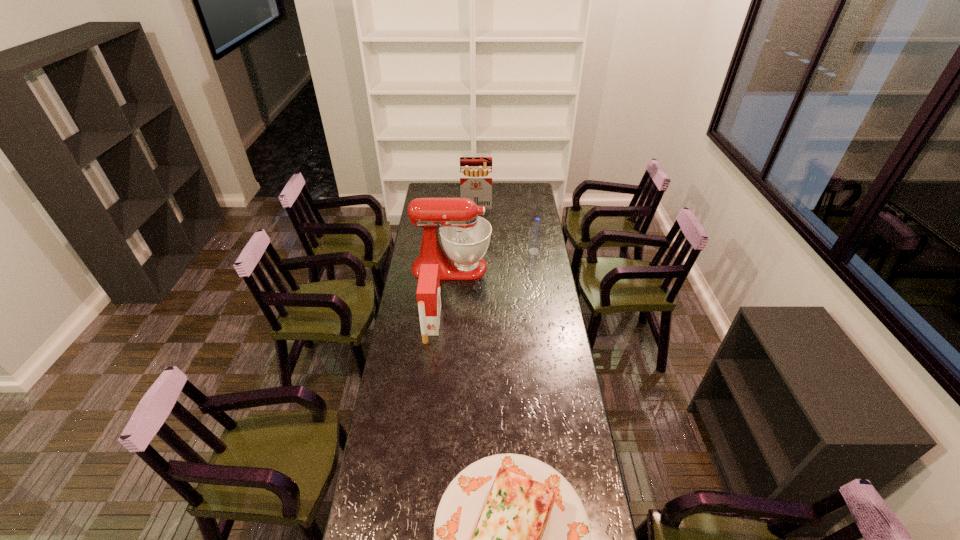
This screenshot has height=540, width=960. I want to click on mixer that is at the left edge, so click(465, 237).

Image resolution: width=960 pixels, height=540 pixels. What are the coordinates of `cigarette case present at the left edge` in the screenshot? It's located at (428, 293).

Image resolution: width=960 pixels, height=540 pixels. I want to click on object located at the right edge, so click(535, 239).

Find the location of a particular element. The height and width of the screenshot is (540, 960). vacant space at the far edge is located at coordinates (446, 196).

Find the location of a particular element. The height and width of the screenshot is (540, 960). free space at the left edge of the desktop is located at coordinates (394, 475).

In the image, there is a desktop. Identify the location of vacant space at the right edge. (538, 369).

Where is `free space at the far left corner of the desktop`? free space at the far left corner of the desktop is located at coordinates (437, 195).

This screenshot has height=540, width=960. Find the location of `vacant space in between the water bottle and the third tallest object`. vacant space in between the water bottle and the third tallest object is located at coordinates (483, 288).

Image resolution: width=960 pixels, height=540 pixels. I want to click on vacant space in between the fourth tallest object and the second tallest object, so click(505, 228).

This screenshot has height=540, width=960. What are the coordinates of `empty space between the fourth tallest object and the taller cigarette case` in the screenshot? It's located at (505, 228).